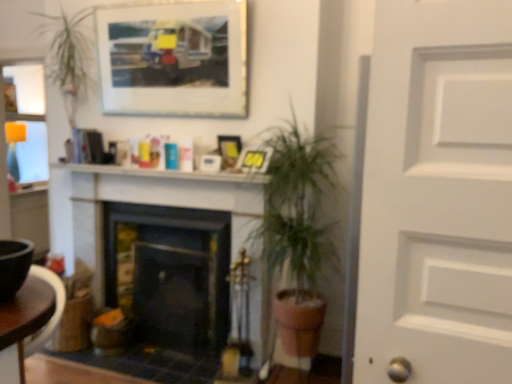
Question: From their relative heights in the image, would you say black matte fireplace at center, placed as the first fireplace when sorted from right to left, is taller or shorter than wooden frame at upper center, which is the 3th picture frame from bottom to top?

Choices:
 (A) tall
 (B) short

Answer: (A)

Question: Is black matte fireplace at center, which appears as the 2th fireplace when viewed from the left, wider or thinner than wooden frame at upper center, which is the 3th picture frame from bottom to top?

Choices:
 (A) thin
 (B) wide

Answer: (B)

Question: Estimate the real-world distances between objects in this image. Which object is farther from the matte plastic picture frame at upper center, the first picture frame in the bottom-to-top sequence?

Choices:
 (A) white glossy mantel at upper center
 (B) brown wooden table at lower left
 (C) black matte fireplace at center, which appears as the 2th fireplace when viewed from the left
 (D) green leafy plant at center
 (E) wooden frame at upper center, which appears as the 1th picture frame when viewed from the top

Answer: (B)

Question: Which object is the farthest from the brown wooden table at lower left?

Choices:
 (A) matte plastic picture frame at upper center, which ranks as the 3th picture frame in top-to-bottom order
 (B) matte plastic picture frame at center, positioned as the second picture frame in top-to-bottom order
 (C) green leafy plant at center
 (D) black matte fireplace at center, the first fireplace in the left-to-right sequence
 (E) black matte fireplace at center, placed as the first fireplace when sorted from right to left

Answer: (B)